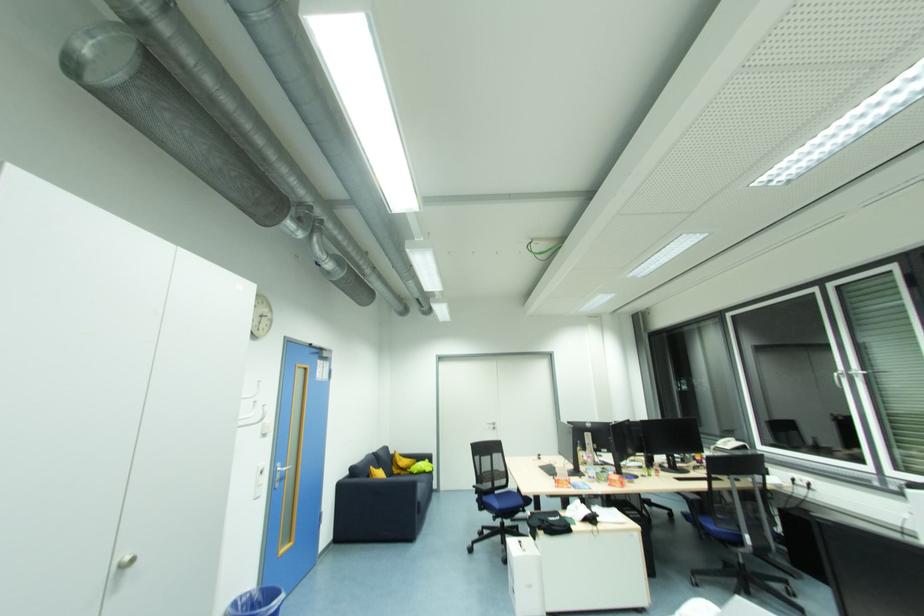
Find where to rotat the white window handle. Please return your answer as a coordinate pair (x, y).

(127, 561)